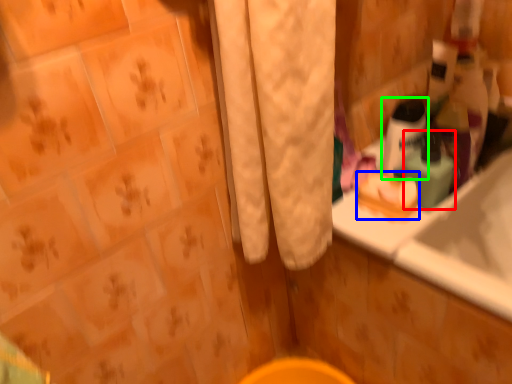
Question: Based on their relative distances, which object is farther from mouthwash (highlighted by a red box)? Choose from soap (highlighted by a blue box) and mouthwash (highlighted by a green box).

Choices:
 (A) soap
 (B) mouthwash

Answer: (A)